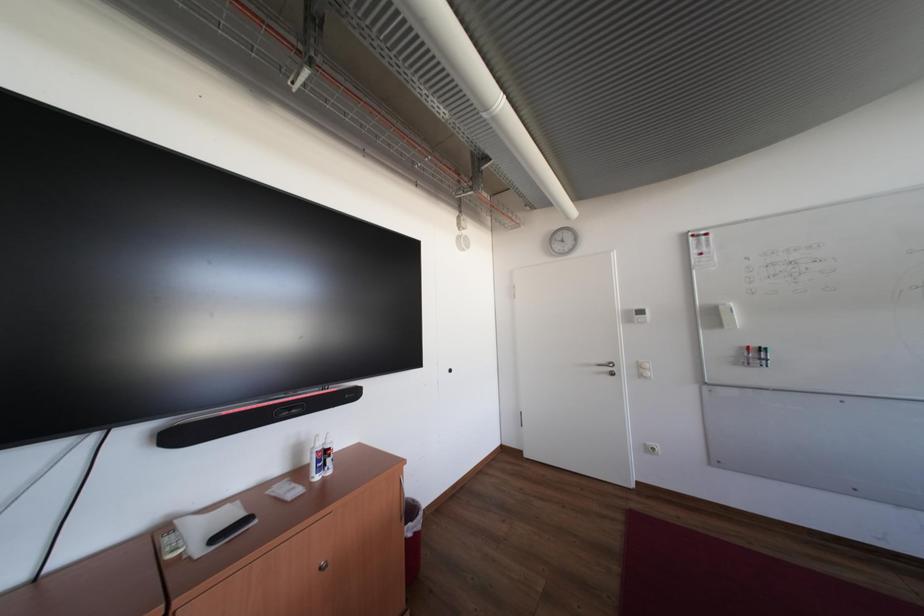
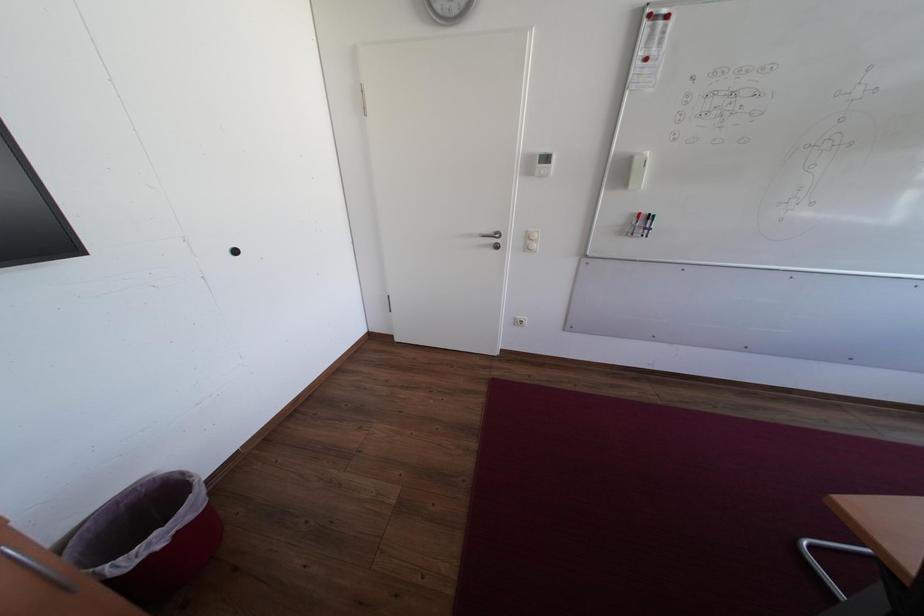
The images are taken continuously from a first-person perspective. In which direction is your viewpoint rotating?

The camera rotated toward right-down.